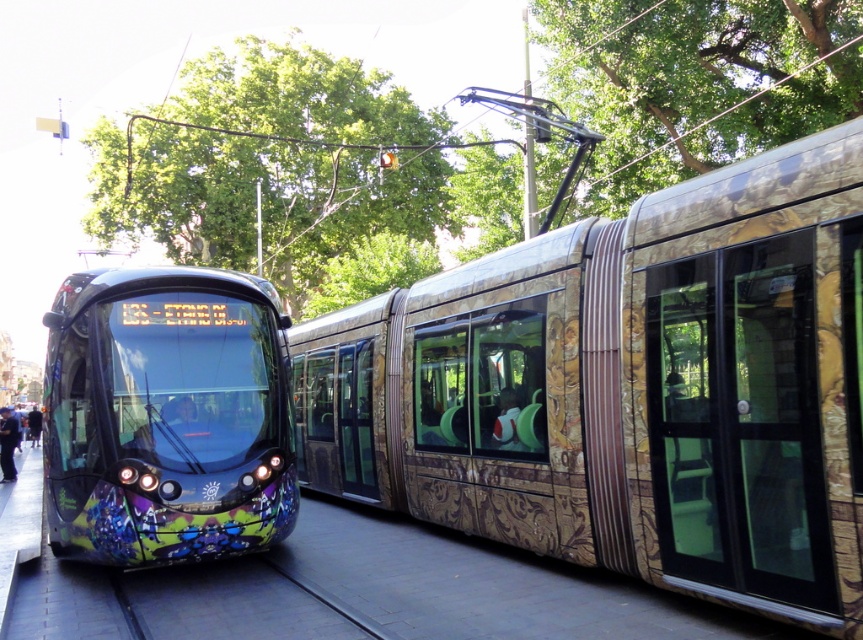
Which of these two, gray concrete track at lower center or metallic blue coach at lower left, stands shorter?

Standing shorter between the two is gray concrete track at lower center.

Which is in front, point (180, 595) or point (14, 449)?

Point (180, 595) is more forward.

Is point (171, 618) closer to viewer compared to point (8, 468)?

Yes, point (171, 618) is closer to viewer.

Find the location of a particular element. Image resolution: width=863 pixels, height=640 pixels. gray concrete track at lower center is located at coordinates (235, 604).

Between point (67, 548) and point (250, 592), which one is positioned behind?

The point (67, 548) is behind.

Based on the photo, is graffiti-covered glass train at left bigger than gray concrete track at lower center?

Correct, graffiti-covered glass train at left is larger in size than gray concrete track at lower center.

The width and height of the screenshot is (863, 640). What do you see at coordinates (167, 417) in the screenshot? I see `graffiti-covered glass train at left` at bounding box center [167, 417].

I want to click on graffiti-covered glass train at left, so click(x=167, y=417).

Who is shorter, gold-patterned tram at center or metallic blue coach at lower left?

metallic blue coach at lower left is shorter.

Does point (744, 378) come closer to viewer compared to point (5, 472)?

That is True.

Which is behind, point (339, 412) or point (8, 432)?

The point (8, 432) is behind.

Find the location of a particular element. The height and width of the screenshot is (640, 863). gold-patterned tram at center is located at coordinates (628, 388).